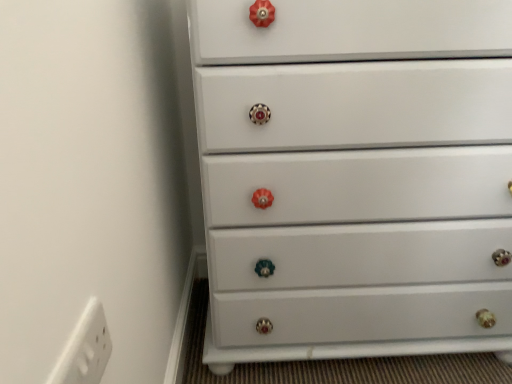
This screenshot has height=384, width=512. Find the location of `white plastic outlet at lower left`. white plastic outlet at lower left is located at coordinates (85, 348).

Describe the element at coordinates (85, 348) in the screenshot. I see `white plastic outlet at lower left` at that location.

This screenshot has height=384, width=512. Describe the element at coordinates (352, 176) in the screenshot. I see `white glossy chest of drawers at center` at that location.

What is the approximate height of white glossy chest of drawers at center?

It is 32.75 inches.

What is the approximate width of white glossy chest of drawers at center?

white glossy chest of drawers at center is 42.20 centimeters in width.

Measure the distance between white glossy chest of drawers at center and camera.

The depth of white glossy chest of drawers at center is 26.28 inches.

Identify the location of white glossy chest of drawers at center. This screenshot has height=384, width=512. (352, 176).

I want to click on white plastic outlet at lower left, so click(85, 348).

Can you confirm if white plastic outlet at lower left is positioned to the right of white glossy chest of drawers at center?

No.

Which object is further away from the camera, white plastic outlet at lower left or white glossy chest of drawers at center?

white glossy chest of drawers at center.

Considering the positions of points (76, 332) and (333, 120), is point (76, 332) farther from camera compared to point (333, 120)?

No, it is not.

From the image's perspective, which one is positioned higher, white plastic outlet at lower left or white glossy chest of drawers at center?

white glossy chest of drawers at center appears higher in the image.

Consider the image. From a real-world perspective, is white plastic outlet at lower left physically below white glossy chest of drawers at center?

Actually, white plastic outlet at lower left is physically above white glossy chest of drawers at center in the real world.

Considering the sizes of objects white plastic outlet at lower left and white glossy chest of drawers at center in the image provided, who is thinner, white plastic outlet at lower left or white glossy chest of drawers at center?

white plastic outlet at lower left.

Considering the sizes of objects white plastic outlet at lower left and white glossy chest of drawers at center in the image provided, who is shorter, white plastic outlet at lower left or white glossy chest of drawers at center?

white plastic outlet at lower left is shorter.

Which of these two, white plastic outlet at lower left or white glossy chest of drawers at center, is bigger?

white glossy chest of drawers at center is bigger.

Is white plastic outlet at lower left located outside white glossy chest of drawers at center?

white plastic outlet at lower left is positioned outside white glossy chest of drawers at center.

Are white plastic outlet at lower left and white glossy chest of drawers at center located far from each other?

No, white plastic outlet at lower left is not far from white glossy chest of drawers at center.

Is white plastic outlet at lower left facing away from white glossy chest of drawers at center?

That's not correct — white plastic outlet at lower left is not looking away from white glossy chest of drawers at center.

Measure the distance between white plastic outlet at lower left and white glossy chest of drawers at center.

white plastic outlet at lower left and white glossy chest of drawers at center are 22.63 inches apart.

The width and height of the screenshot is (512, 384). I want to click on chest of drawers on the right of the white plastic outlet at lower left, so [352, 176].

Does white glossy chest of drawers at center appear on the right side of white plastic outlet at lower left?

Yes, white glossy chest of drawers at center is to the right of white plastic outlet at lower left.

Relative to white plastic outlet at lower left, is white glossy chest of drawers at center in front or behind?

In the image, white glossy chest of drawers at center appears behind white plastic outlet at lower left.

Considering the positions of point (457, 39) and point (82, 333), is point (457, 39) closer or farther from the camera than point (82, 333)?

Clearly, point (457, 39) is more distant from the camera than point (82, 333).

From the image's perspective, is white glossy chest of drawers at center below white plastic outlet at lower left?

Incorrect, from the image's perspective, white glossy chest of drawers at center is higher than white plastic outlet at lower left.

From a real-world perspective, is white glossy chest of drawers at center positioned over white plastic outlet at lower left based on gravity?

No, from a real-world perspective, white glossy chest of drawers at center is not on top of white plastic outlet at lower left.

In terms of width, does white glossy chest of drawers at center look wider or thinner when compared to white plastic outlet at lower left?

white glossy chest of drawers at center is wider than white plastic outlet at lower left.

Can you confirm if white glossy chest of drawers at center is shorter than white plastic outlet at lower left?

No, white glossy chest of drawers at center is not shorter than white plastic outlet at lower left.

In the scene shown: Between white glossy chest of drawers at center and white plastic outlet at lower left, which one has larger size?

With larger size is white glossy chest of drawers at center.

Would you say white glossy chest of drawers at center contains white plastic outlet at lower left?

No, white plastic outlet at lower left is not inside white glossy chest of drawers at center.

Is white glossy chest of drawers at center beside white plastic outlet at lower left?

There is a gap between white glossy chest of drawers at center and white plastic outlet at lower left.

Is white glossy chest of drawers at center positioned with its back to white plastic outlet at lower left?

No, white glossy chest of drawers at center is not facing away from white plastic outlet at lower left.

Locate an element on the screen. This screenshot has height=384, width=512. electric outlet in front of the white glossy chest of drawers at center is located at coordinates (85, 348).

In the image, there is a white plastic outlet at lower left. Identify the location of the chest of drawers below it (from a real-world perspective). The height and width of the screenshot is (384, 512). (352, 176).

Find the location of a particular element. The image size is (512, 384). electric outlet on the left of white glossy chest of drawers at center is located at coordinates (85, 348).